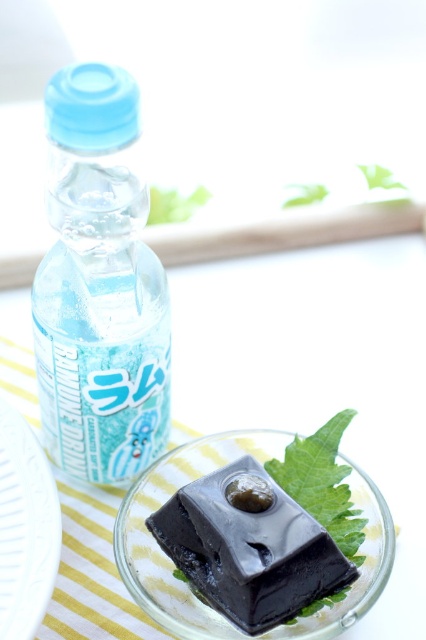
Question: Can you confirm if blue plastic bottle at left is positioned below shiny dark chocolate at center?

Choices:
 (A) yes
 (B) no

Answer: (B)

Question: Is blue plastic bottle at left smaller than shiny dark chocolate at center?

Choices:
 (A) no
 (B) yes

Answer: (A)

Question: Which is nearer to the shiny dark chocolate at center?

Choices:
 (A) white textured platter at lower left
 (B) blue plastic bottle at left

Answer: (A)

Question: Observing the image, what is the correct spatial positioning of shiny dark chocolate at center in reference to white textured platter at lower left?

Choices:
 (A) left
 (B) right

Answer: (B)

Question: Which of these objects is positioned closest to the blue plastic bottle at left?

Choices:
 (A) white textured platter at lower left
 (B) shiny dark chocolate at center

Answer: (A)

Question: Which object is closer to the camera taking this photo?

Choices:
 (A) blue plastic bottle at left
 (B) white textured platter at lower left

Answer: (B)